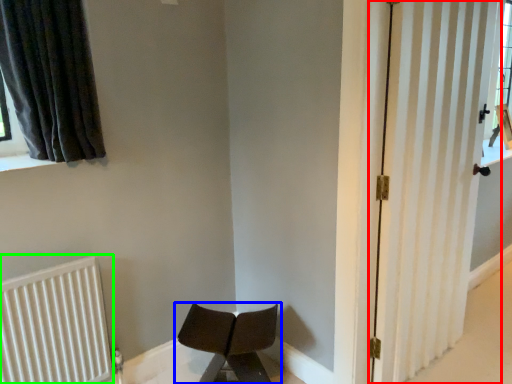
Question: Which is nearer to the door (highlighted by a red box)? chair (highlighted by a blue box) or radiator (highlighted by a green box).

Choices:
 (A) chair
 (B) radiator

Answer: (A)